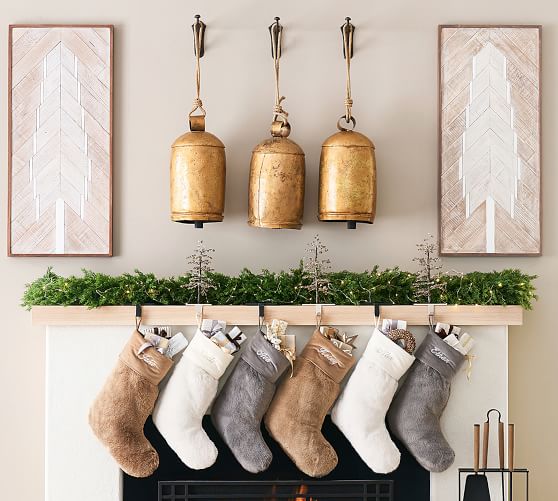
You are a GUI agent. You are given a task and a screenshot of the screen. Output one action in this format:
    pyautogui.click(x=<x>, y=<y>)
    Task: Click on the fireplace
    The image size is (558, 501).
    Given the screenshot: What is the action you would take?
    pyautogui.click(x=69, y=354)